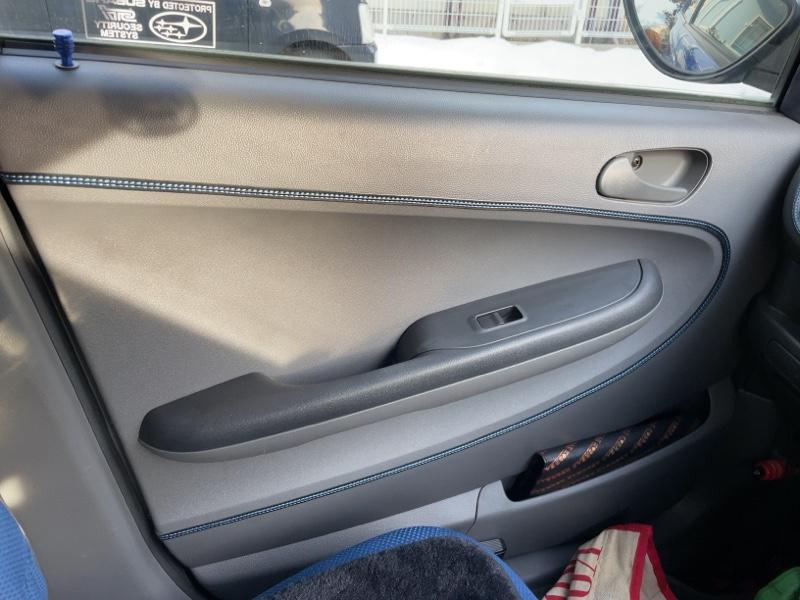
Where is `door handle`? door handle is located at coordinates (630, 175).